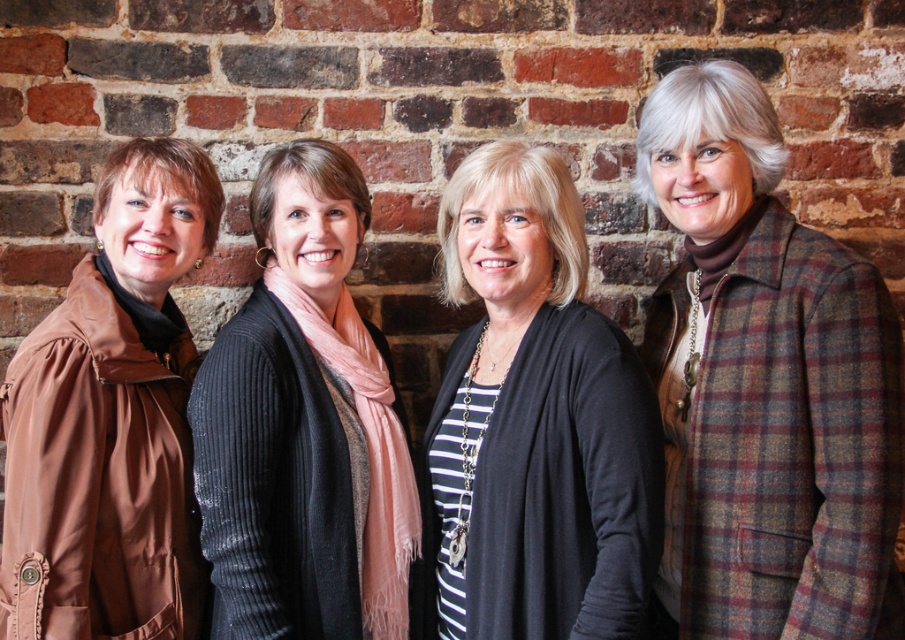
Which is behind, point (510, 301) or point (256, 628)?

The point (510, 301) is behind.

Between black knit cardigan at center and black ribbed sweater at center, which one is positioned higher?

black ribbed sweater at center is above.

The image size is (905, 640). In order to click on black knit cardigan at center in this screenshot , I will do coord(534,424).

Can you confirm if plaid wool coat at right is bigger than black knit cardigan at center?

No, plaid wool coat at right is not bigger than black knit cardigan at center.

Is point (875, 500) positioned before point (508, 212)?

Yes.

Locate an element on the screen. The height and width of the screenshot is (640, 905). plaid wool coat at right is located at coordinates (767, 385).

Can you confirm if plaid wool coat at right is smaller than black ribbed sweater at center?

Actually, plaid wool coat at right might be larger than black ribbed sweater at center.

Is plaid wool coat at right taller than black ribbed sweater at center?

Yes, plaid wool coat at right is taller than black ribbed sweater at center.

Does point (773, 412) come closer to viewer compared to point (300, 468)?

Yes.

I want to click on plaid wool coat at right, so click(x=767, y=385).